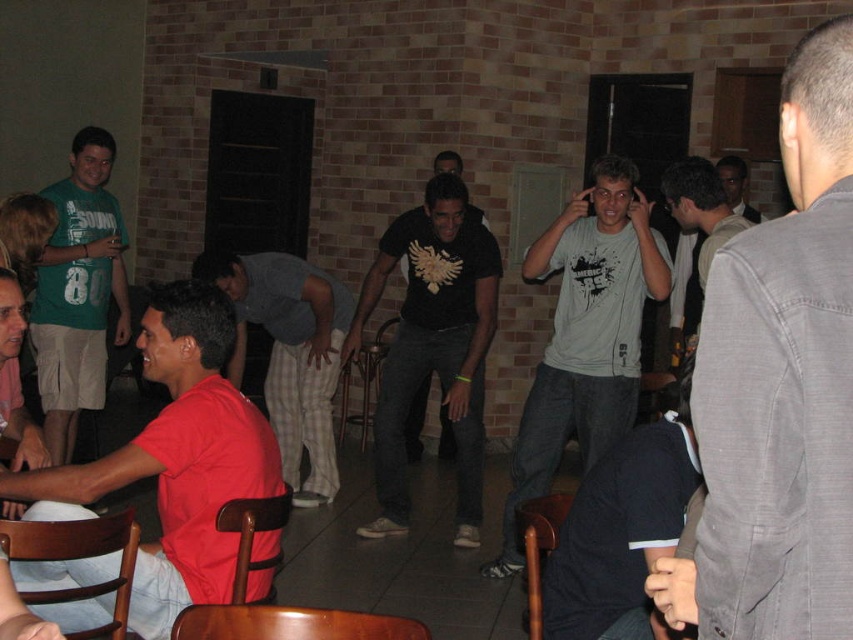
Measure the distance between brown wood chair at lower center and gray cotton shirt at center.

A distance of 9.22 feet exists between brown wood chair at lower center and gray cotton shirt at center.

Can you confirm if brown wood chair at lower center is positioned above gray cotton shirt at center?

Incorrect, brown wood chair at lower center is not positioned above gray cotton shirt at center.

Between point (334, 636) and point (682, 205), which one is positioned in front?

Point (334, 636) is in front.

Find the location of a particular element. The width and height of the screenshot is (853, 640). brown wood chair at lower center is located at coordinates (289, 624).

Is black matte t-shirt at center above gray cotton shirt at center?

No.

Based on the photo, which of these two, black matte t-shirt at center or gray cotton shirt at center, stands taller?

black matte t-shirt at center

This screenshot has width=853, height=640. I want to click on black matte t-shirt at center, so click(432, 346).

Identify the location of black matte t-shirt at center. (432, 346).

Which is below, dark gray fabric at lower right or matte gray shirt at center?

dark gray fabric at lower right

Which is in front, point (618, 577) or point (724, 193)?

Point (618, 577) is more forward.

Does point (604, 577) come in front of point (730, 157)?

Yes, point (604, 577) is in front of point (730, 157).

This screenshot has width=853, height=640. In order to click on dark gray fabric at lower right in this screenshot , I will do `click(622, 531)`.